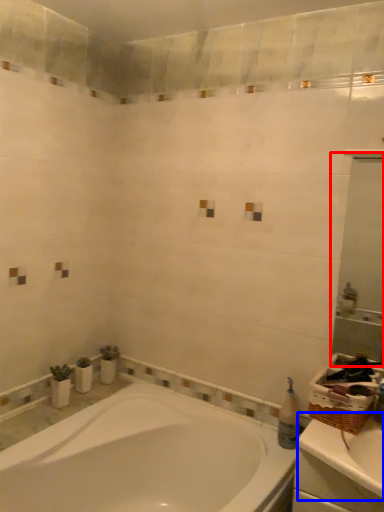
Question: Which object appears farthest to the camera in this image, mirror (highlighted by a red box) or counter top (highlighted by a blue box)?

Choices:
 (A) mirror
 (B) counter top

Answer: (A)